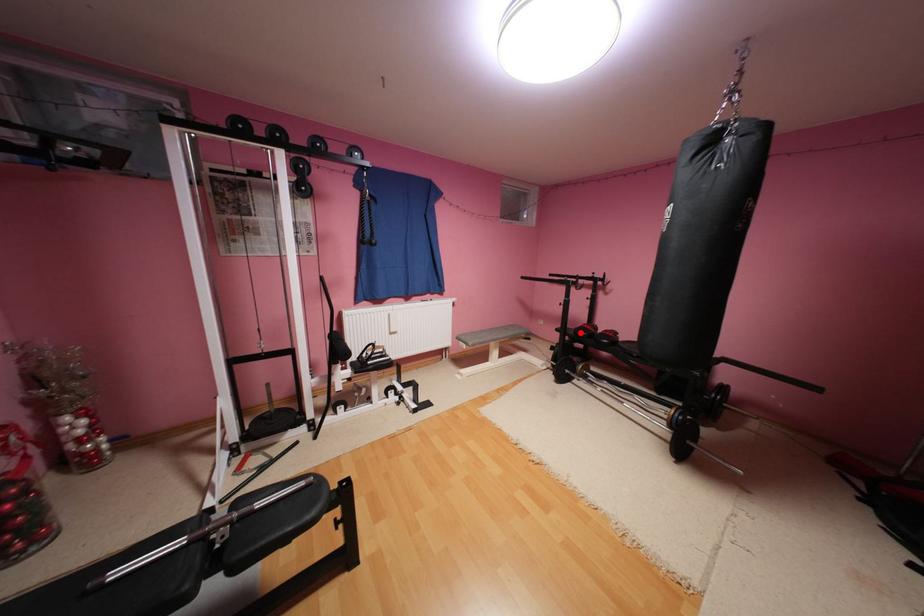
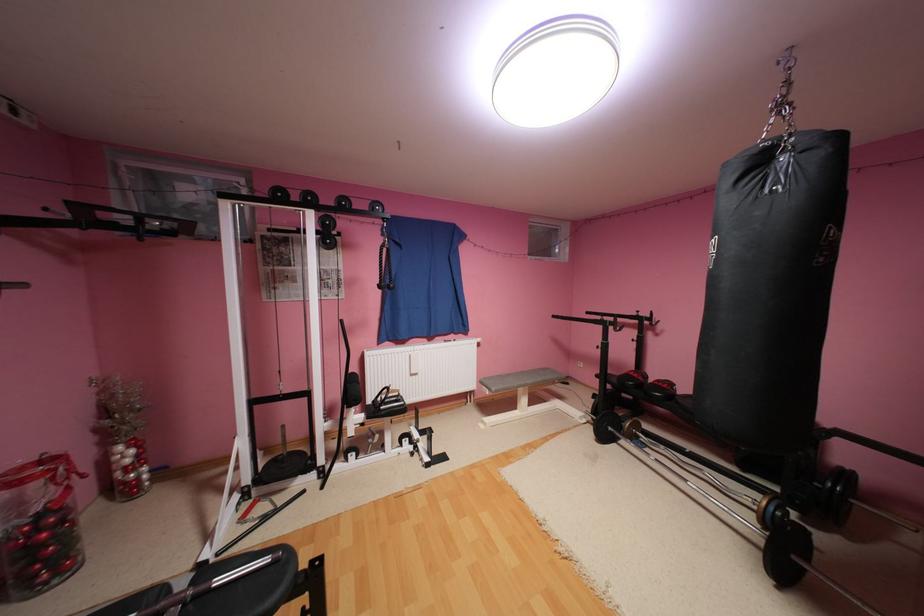
Question: I am providing you with two images of the same scene from different viewpoints. Given a red point in image1, look at the same physical point in image2. Is it:

Choices:
 (A) Closer to the viewpoint
 (B) Farther from the viewpoint

Answer: (B)